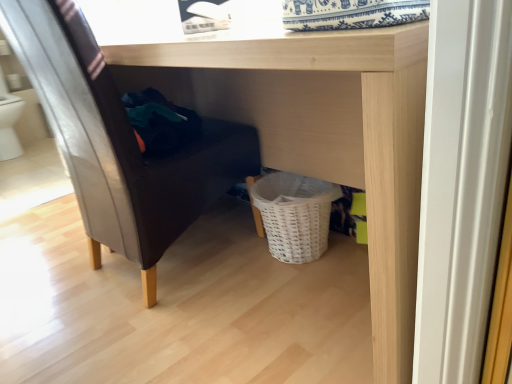
Question: Is wooden table at center to the left or to the right of matte black chair at left in the image?

Choices:
 (A) left
 (B) right

Answer: (B)

Question: Considering the positions of wooden table at center and matte black chair at left in the image, is wooden table at center taller or shorter than matte black chair at left?

Choices:
 (A) tall
 (B) short

Answer: (B)

Question: From the image's perspective, is wooden table at center positioned above or below matte black chair at left?

Choices:
 (A) above
 (B) below

Answer: (B)

Question: Based on their sizes in the image, would you say matte black chair at left is bigger or smaller than wooden table at center?

Choices:
 (A) small
 (B) big

Answer: (A)

Question: Considering their positions, is matte black chair at left located in front of or behind wooden table at center?

Choices:
 (A) behind
 (B) front

Answer: (A)

Question: From a real-world perspective, relative to wooden table at center, is matte black chair at left vertically above or below?

Choices:
 (A) above
 (B) below

Answer: (A)

Question: Which is correct: matte black chair at left is inside wooden table at center, or outside of it?

Choices:
 (A) inside
 (B) outside

Answer: (A)